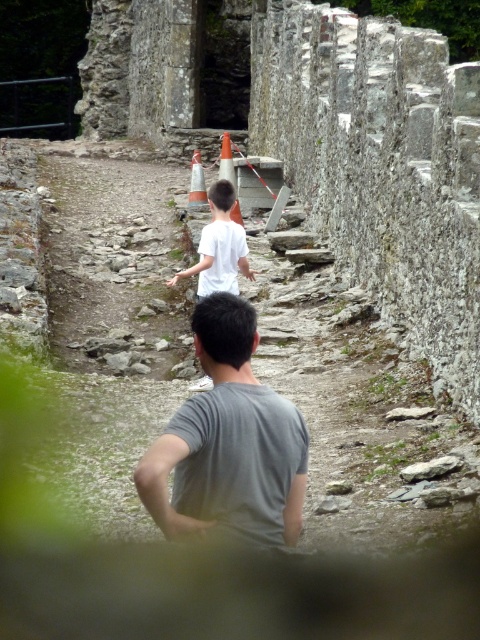
Is gray matte shirt at center below orange plastic traffic cone at center?

Yes, gray matte shirt at center is below orange plastic traffic cone at center.

Looking at this image, can you confirm if gray matte shirt at center is bigger than orange plastic traffic cone at center?

No, gray matte shirt at center is not bigger than orange plastic traffic cone at center.

Is point (208, 392) more distant than point (195, 164)?

No, it is in front of (195, 164).

In order to click on gray matte shirt at center in this screenshot , I will do `click(228, 442)`.

Is gray matte shirt at center positioned at the back of white matte shirt at center?

That is False.

Does gray matte shirt at center appear over white matte shirt at center?

No, gray matte shirt at center is not above white matte shirt at center.

Which is in front, point (276, 483) or point (216, 214)?

Point (276, 483)

This screenshot has width=480, height=640. I want to click on gray matte shirt at center, so click(x=228, y=442).

Where is `white matte shirt at center`? This screenshot has width=480, height=640. white matte shirt at center is located at coordinates (218, 246).